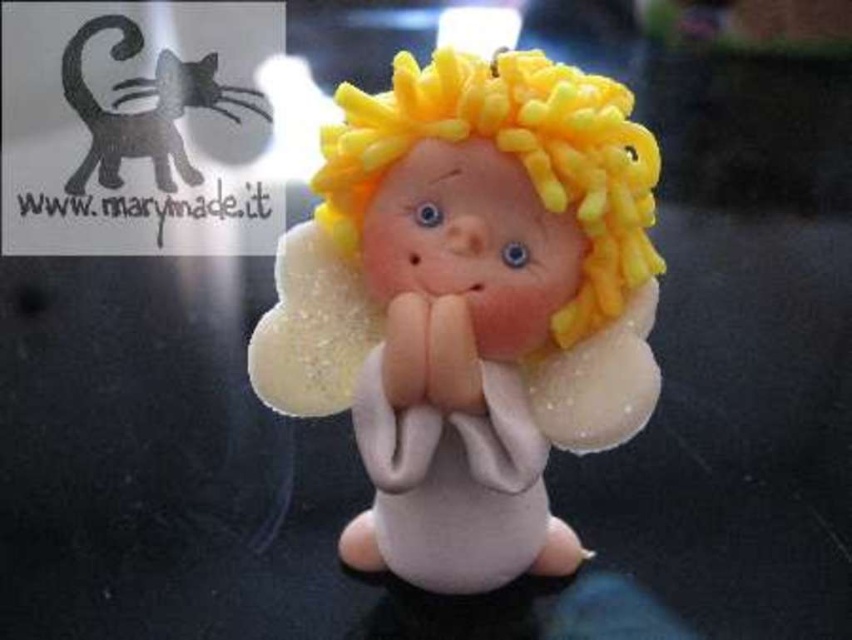
At what (x,y) coordinates should I click in order to perform the action: click on matte white angel at center. Please return your answer as a coordinate pair (x, y). The height and width of the screenshot is (640, 852). Looking at the image, I should click on (470, 305).

Which is behind, point (275, 321) or point (102, 132)?

The point (102, 132) is behind.

Locate an element on the screen. This screenshot has height=640, width=852. matte white angel at center is located at coordinates (470, 305).

Can you confirm if yellow fluffy hair at center is bigger than matte black cat at upper left?

Correct, yellow fluffy hair at center is larger in size than matte black cat at upper left.

Measure the distance from yellow fluffy hair at center to matte black cat at upper left.

The distance of yellow fluffy hair at center from matte black cat at upper left is 15.16 inches.

Between point (574, 179) and point (110, 131), which one is positioned behind?

The point (110, 131) is more distant.

Locate an element on the screen. The width and height of the screenshot is (852, 640). yellow fluffy hair at center is located at coordinates (511, 156).

Is matte white angel at center shorter than yellow fluffy hair at center?

Incorrect, matte white angel at center's height does not fall short of yellow fluffy hair at center's.

Looking at this image, is matte white angel at center bigger than yellow fluffy hair at center?

Yes, matte white angel at center is bigger than yellow fluffy hair at center.

Where is `matte white angel at center`? The image size is (852, 640). matte white angel at center is located at coordinates (470, 305).